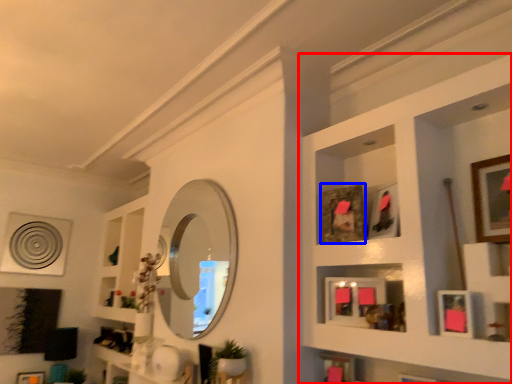
Question: Among these objects, which one is farthest to the camera, shelf (highlighted by a red box) or picture frame (highlighted by a blue box)?

Choices:
 (A) shelf
 (B) picture frame

Answer: (B)